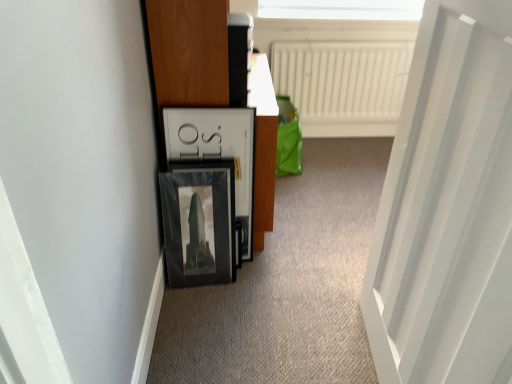
Question: From the image's perspective, is white smooth door at right located beneath wooden dresser at left?

Choices:
 (A) no
 (B) yes

Answer: (B)

Question: Can you confirm if white smooth door at right is positioned to the left of wooden dresser at left?

Choices:
 (A) yes
 (B) no

Answer: (B)

Question: Is white smooth door at right located outside wooden dresser at left?

Choices:
 (A) yes
 (B) no

Answer: (A)

Question: Does white smooth door at right have a lesser width compared to wooden dresser at left?

Choices:
 (A) yes
 (B) no

Answer: (A)

Question: Considering the relative sizes of white smooth door at right and wooden dresser at left in the image provided, is white smooth door at right taller than wooden dresser at left?

Choices:
 (A) no
 (B) yes

Answer: (B)

Question: Considering the relative sizes of white smooth door at right and wooden dresser at left in the image provided, is white smooth door at right wider than wooden dresser at left?

Choices:
 (A) no
 (B) yes

Answer: (A)

Question: Can white smooth door at right be found inside white matte radiator at upper center?

Choices:
 (A) yes
 (B) no

Answer: (B)

Question: Can we say white matte radiator at upper center lies outside white smooth door at right?

Choices:
 (A) yes
 (B) no

Answer: (A)

Question: Is white matte radiator at upper center smaller than white smooth door at right?

Choices:
 (A) yes
 (B) no

Answer: (A)

Question: Is white matte radiator at upper center shorter than white smooth door at right?

Choices:
 (A) no
 (B) yes

Answer: (B)

Question: Does white matte radiator at upper center come in front of white smooth door at right?

Choices:
 (A) yes
 (B) no

Answer: (B)

Question: Is white matte radiator at upper center looking in the opposite direction of white smooth door at right?

Choices:
 (A) yes
 (B) no

Answer: (B)

Question: Is wooden dresser at left far away from white matte radiator at upper center?

Choices:
 (A) no
 (B) yes

Answer: (B)